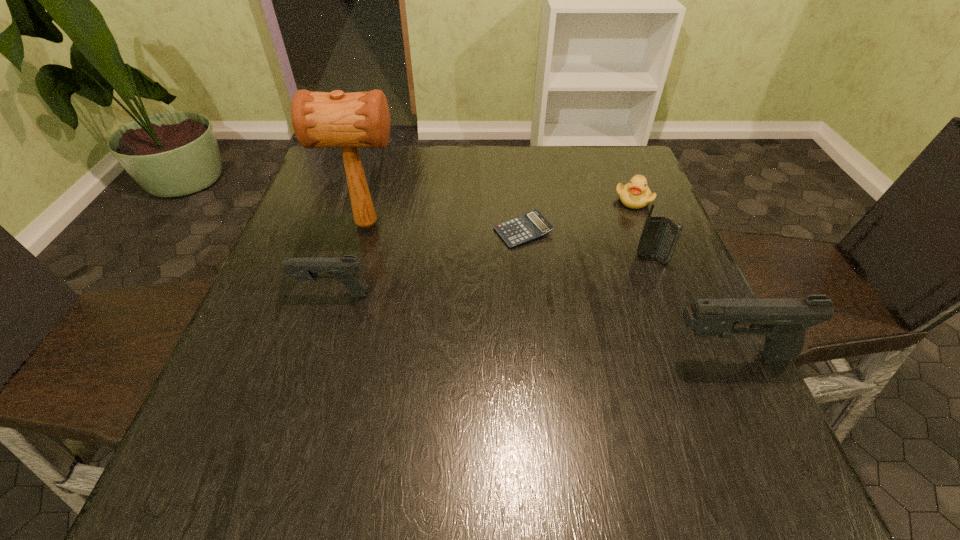
Where is `the shorter pistol`? This screenshot has height=540, width=960. the shorter pistol is located at coordinates (345, 269).

At what (x,y) coordinates should I click in order to perform the action: click on the third shortest object. Please return your answer as a coordinate pair (x, y). Looking at the image, I should click on (345, 269).

This screenshot has width=960, height=540. In order to click on the nearest object in this screenshot , I will do `click(783, 321)`.

Identify the location of the taller pistol. (783, 321).

Locate an element on the screen. the fourth object from right to left is located at coordinates (x=531, y=225).

Where is `calculator`? calculator is located at coordinates (531, 225).

The width and height of the screenshot is (960, 540). I want to click on cellular telephone, so click(659, 236).

You are a GUI agent. You are given a task and a screenshot of the screen. Output one action in this format:
    pyautogui.click(x=<x>, y=<y>)
    Task: Click on the mallet
    Image resolution: width=960 pixels, height=540 pixels.
    Given the screenshot: What is the action you would take?
    point(320,119)

Where is `the fifth tallest object`? This screenshot has height=540, width=960. the fifth tallest object is located at coordinates (636, 194).

This screenshot has height=540, width=960. Identify the location of vacant space situated 0.060m at the barrel of the shorter pistol. (267, 294).